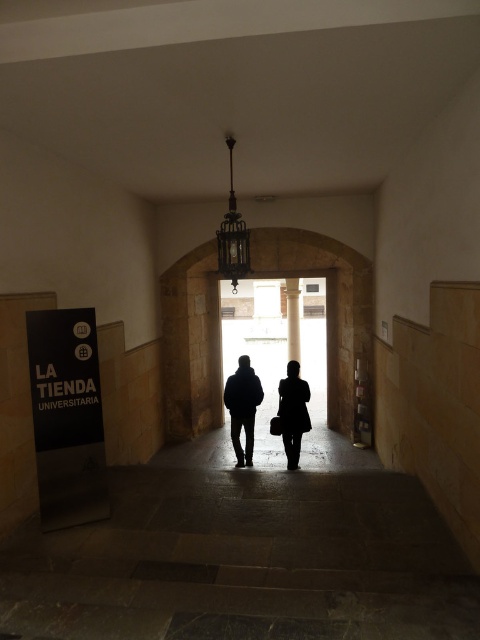
You are a delivery person with a cart that is 2 feet wide. You need to navigate through the corridor between the black matte couple at center and the black signboard on the left side. Can your cart fit through the space between them?

The black matte couple at center and the black signboard on the left side are 22.70 feet apart. Since your cart is only 2 feet wide, it can easily fit through the space between them as the distance is much wider than the cart.

You are carrying a large box that is 4 meters long and need to move it through the corridor. The corridor has a dark blue jacket at center and a smooth stone pillar at center. Can you fit the box between them without bending it?

The distance between the dark blue jacket at center and the smooth stone pillar at center is 4.42 meters, so the 4 meter long box can fit between them without bending since the space is slightly larger than the box.